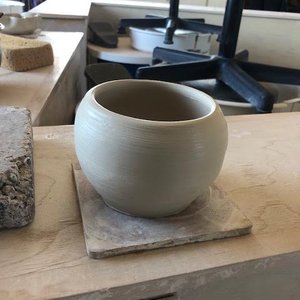
Image resolution: width=300 pixels, height=300 pixels. Find the location of `bowl`. bowl is located at coordinates (154, 35).